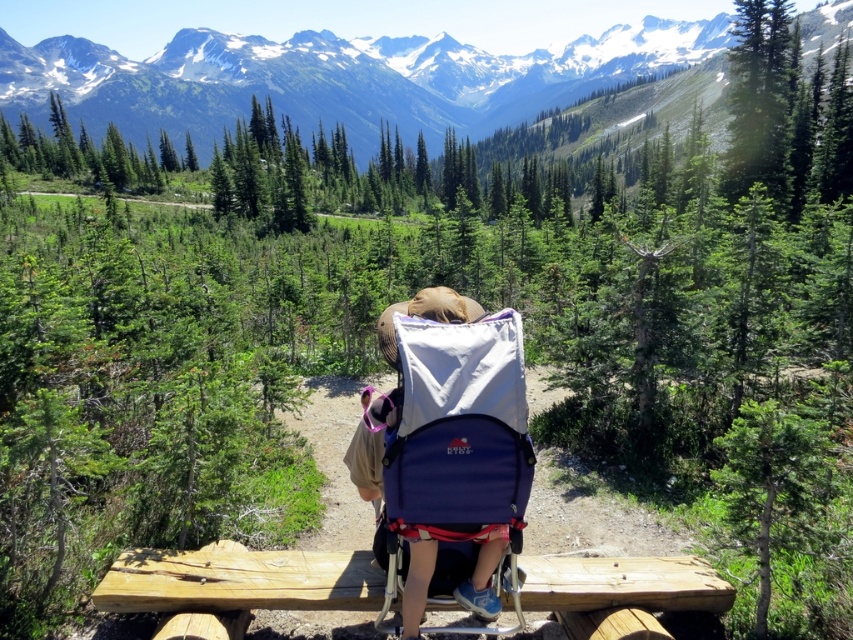
Can you confirm if snowy granite mountains at upper center is positioned below blue fabric baby carriage at center?

No.

Does snowy granite mountains at upper center appear on the right side of blue fabric baby carriage at center?

Yes, snowy granite mountains at upper center is to the right of blue fabric baby carriage at center.

Locate an element on the screen. snowy granite mountains at upper center is located at coordinates (339, 77).